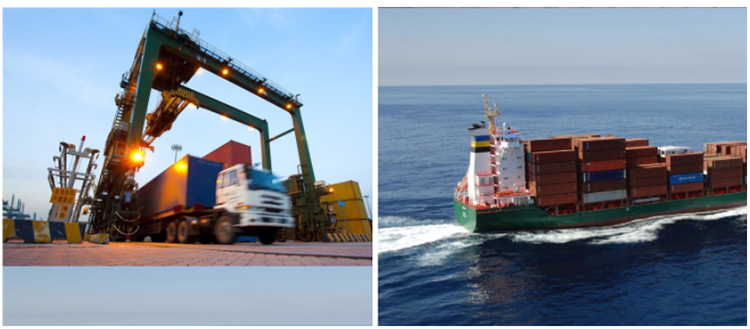
Identify the location of lights. This screenshot has width=750, height=329. (286, 106), (252, 90), (226, 71), (223, 116), (134, 153), (157, 66).